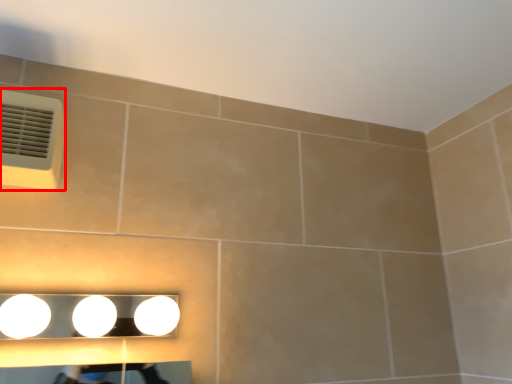
Question: From the image's perspective, what is the correct spatial relationship of air conditioning (annotated by the red box) in relation to fixture?

Choices:
 (A) above
 (B) below

Answer: (A)